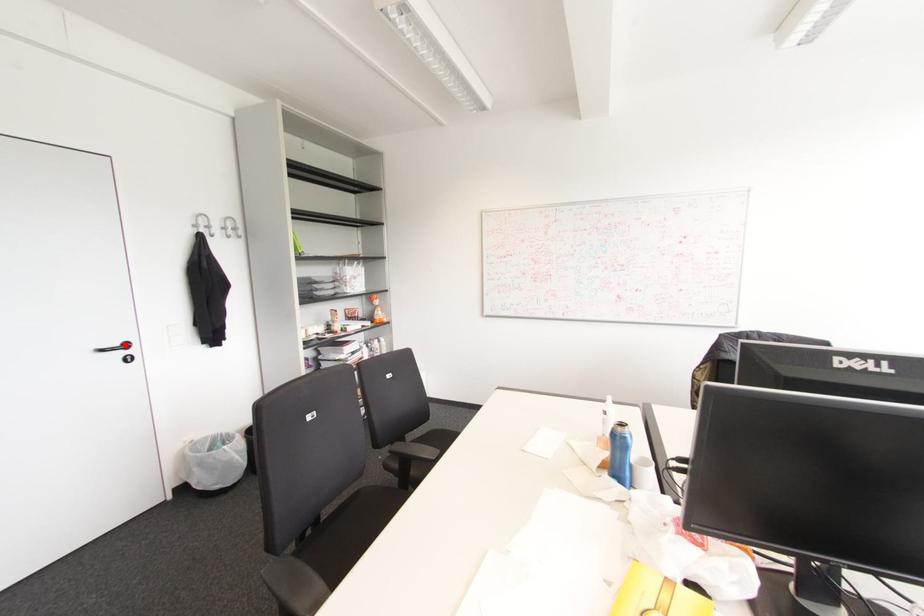
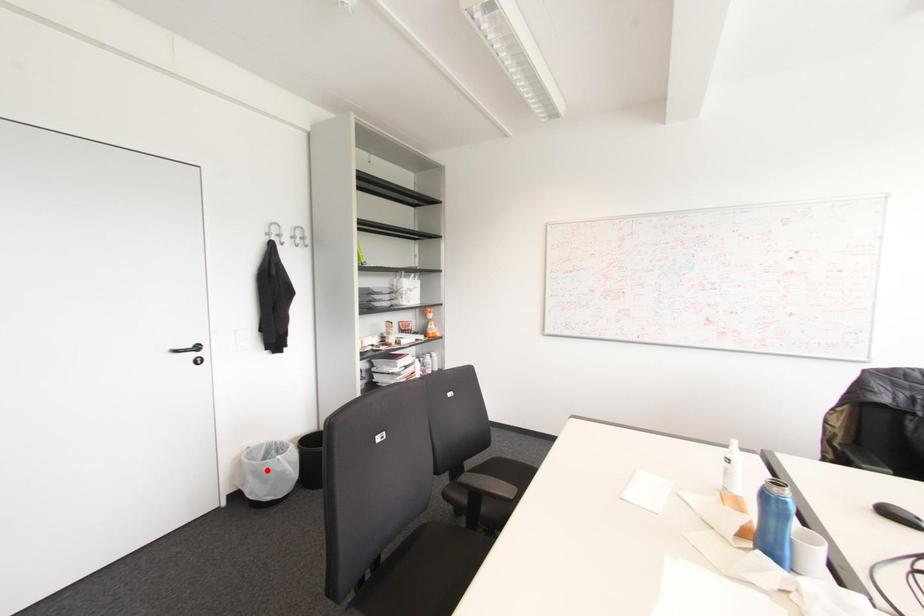
I am providing you with two images of the same scene from different viewpoints. A red point is marked on the first image and another point is marked on the second image. Is the red point in image1 aligned with the point shown in image2?

No